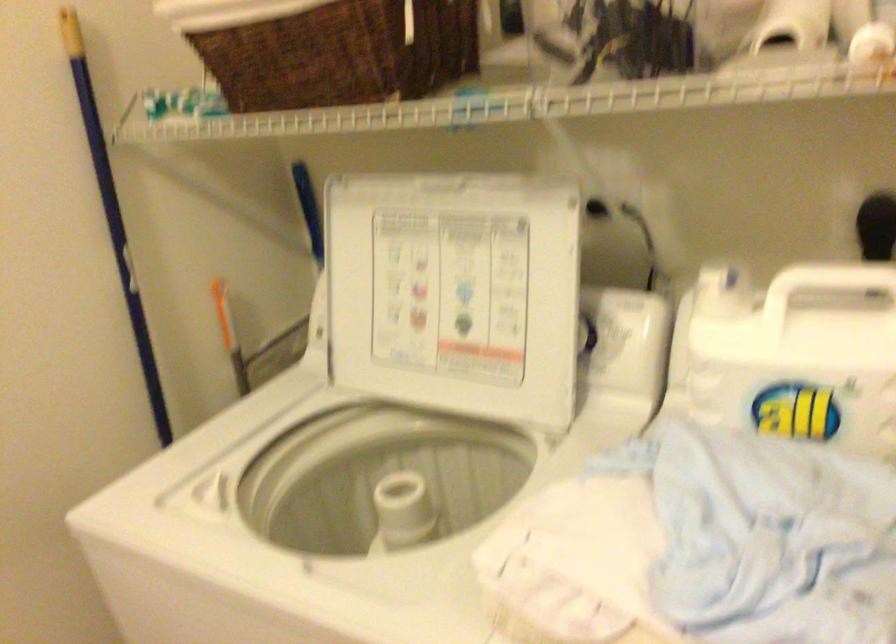
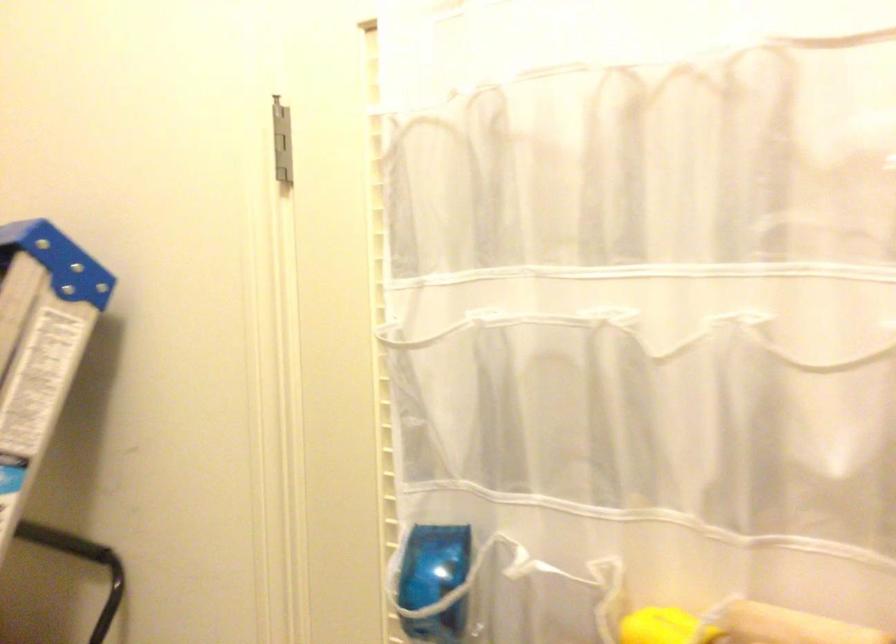
Question: The camera is either moving clockwise (left) or counter-clockwise (right) around the object. The first image is from the beginning of the video and the second image is from the end. Is the camera moving left or right when shooting the video?

Choices:
 (A) Left
 (B) Right

Answer: (B)